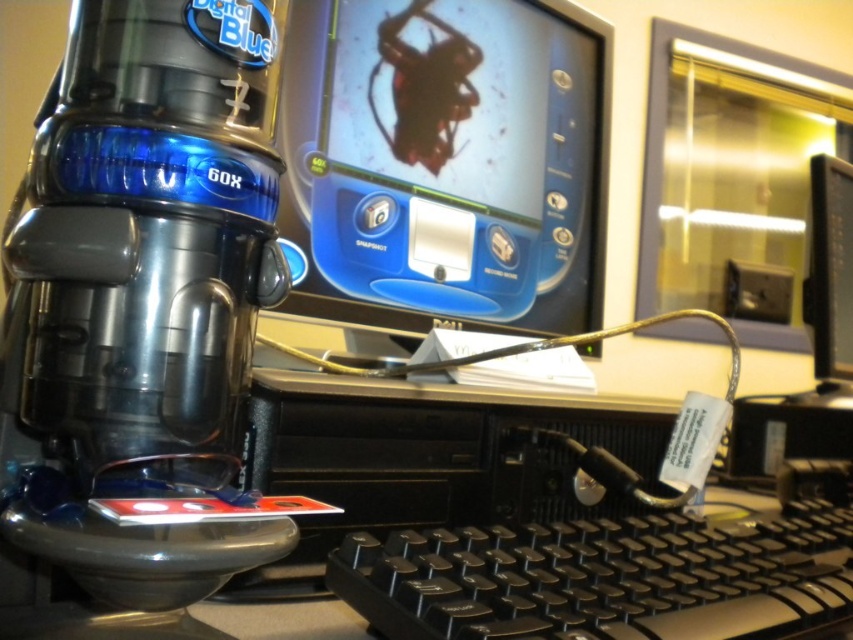
Is black plastic keyboard at center closer to camera compared to black glossy monitor at upper center?

Yes.

Is point (805, 598) closer to camera compared to point (846, 276)?

That is True.

This screenshot has height=640, width=853. I want to click on black plastic keyboard at center, so click(x=602, y=577).

Between matte plastic monitor at center and black glossy monitor at upper center, which one has less height?

With less height is black glossy monitor at upper center.

Which is above, matte plastic monitor at center or black glossy monitor at upper center?

matte plastic monitor at center is higher up.

Is point (396, 19) farther from viewer compared to point (843, 230)?

No, (396, 19) is closer to viewer.

At what (x,y) coordinates should I click in order to perform the action: click on matte plastic monitor at center. Please return your answer as a coordinate pair (x, y). The image size is (853, 640). Looking at the image, I should click on (445, 161).

Describe the element at coordinates (445, 161) in the screenshot. I see `matte plastic monitor at center` at that location.

Based on the photo, is matte plastic monitor at center bigger than black plastic keyboard at center?

Correct, matte plastic monitor at center is larger in size than black plastic keyboard at center.

Between point (474, 221) and point (621, 557), which one is positioned in front?

Point (621, 557)

Where is `matte plastic monitor at center`? matte plastic monitor at center is located at coordinates (445, 161).